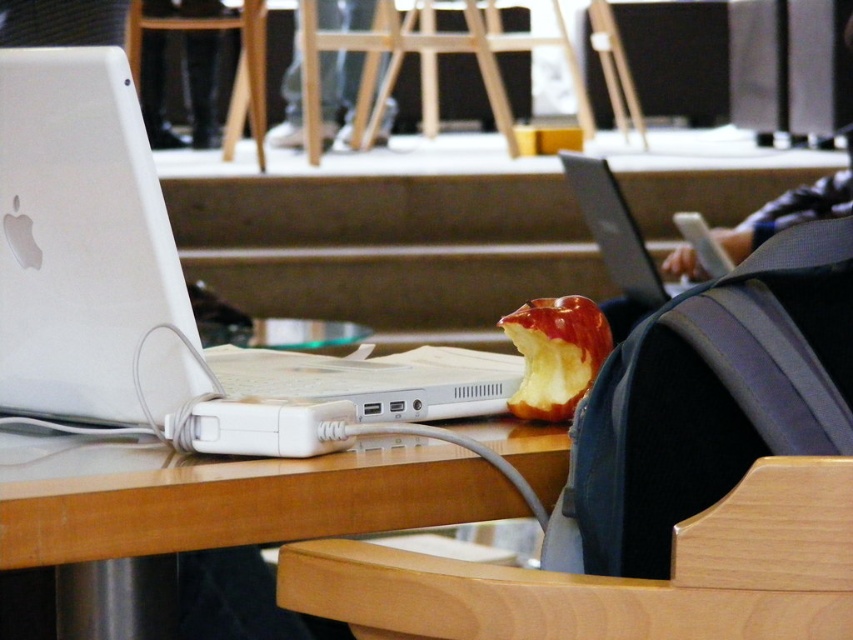
You are standing in a cafe and want to take a photo of the point at coordinates (715, 618). If your camera is 35.44 inches away from that point, is the distance within the recommended 36 inches for clear photos?

Yes, the point at (715, 618) is 35.44 inches away from the camera, which is within the recommended 36 inches for clear photos.

You are organizing a small snack for a meeting and need to place both the shiny red apple at center and the silver metallic laptop at center on a table. However, the table has limited space. Based on their sizes, which object should you place first to ensure both fit comfortably?

The shiny red apple at center is smaller than the silver metallic laptop at center. To ensure both fit comfortably, place the larger silver metallic laptop at center first, then the smaller shiny red apple at center next to it.